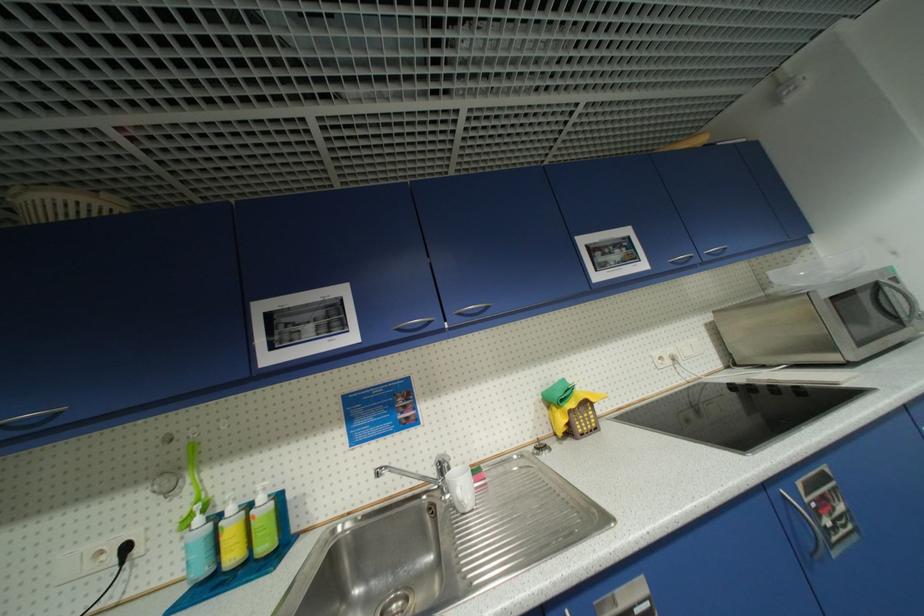
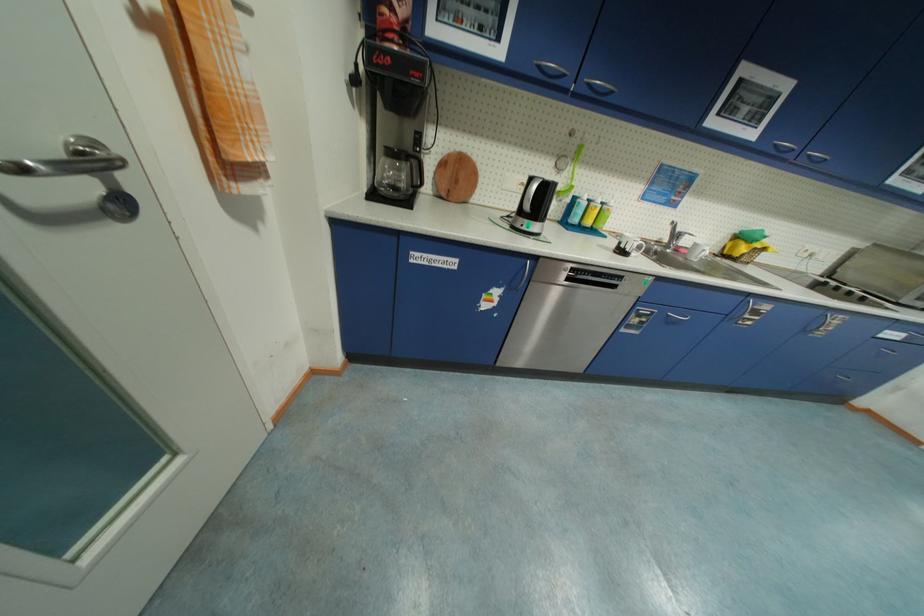
Locate, in the second image, the point that corresponds to (x=105, y=554) in the first image.

(529, 185)